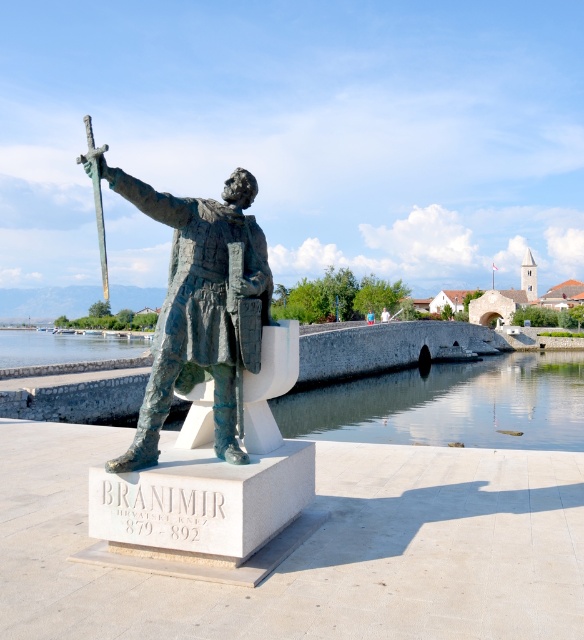
From the picture: You are a tourist visiting the waterfront area and want to take a photo of the bronze statue at center. However, you need to ensure that the clear water at statue right doesn not appear in the background. Is this possible?

The clear water at statue right is below the bronze statue at center, so positioning yourself to frame the statue without including the water in the background would require angling the camera upwards to focus solely on the statue and avoid the lower area where the water is located.

You are an art conservator assessing the space requirements for storing the bronze statue at center and the bronze metallic sword at center. Based on their sizes, which object would require a smaller storage area?

The bronze statue at center occupies less space than the bronze metallic sword at center, so it would require a smaller storage area.

You are standing at the waterfront looking at the statue of Branimir. There are two points marked in the image. The first point is at coordinate point(182, 356) and the second point is at coordinate point(96, 225). Which of these two points is closer to you?

Point(182, 356) is in front of point(96, 225), so it is closer to you.